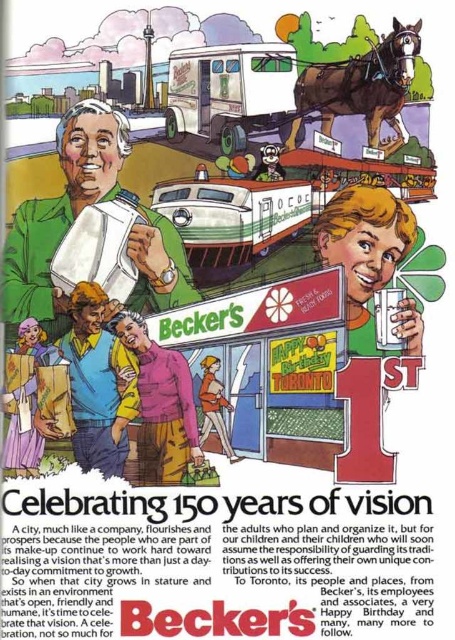
You are designing a poster for Becker 150th anniversary and need to place the green fabric shirt at upper left and smooth plastic cup at center. Since the shirt is larger, where should you place them to ensure both elements are visible without overlapping?

Place the green fabric shirt at upper left and the smooth plastic cup at center so that the larger shirt does not overlap the smaller cup, ensuring both are clearly visible on the poster.